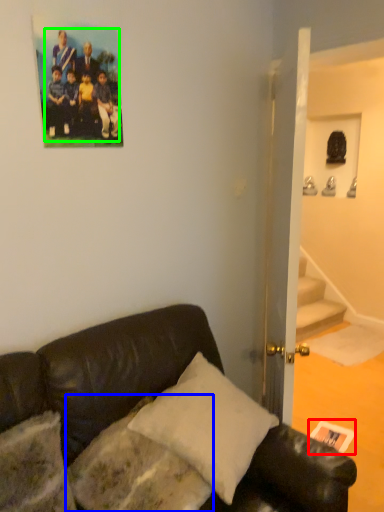
Question: Which object is the closest to the postcard (highlighted by a red box)? Choose among these: pillow (highlighted by a blue box) or football team (highlighted by a green box).

Choices:
 (A) pillow
 (B) football team

Answer: (A)